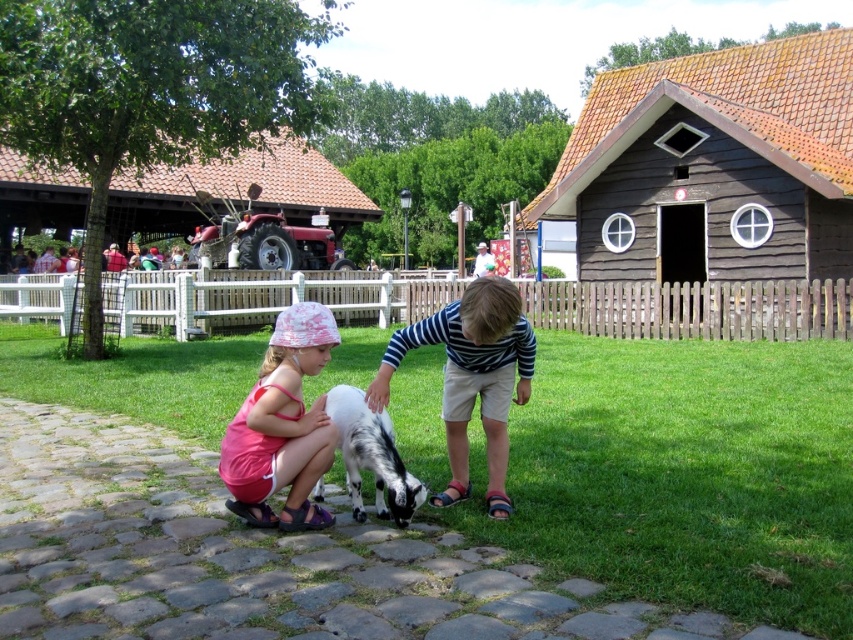
You are standing at the center of the image and want to walk towards the green grass at center. Which direction should you move to reach it?

The green grass at center is already at the center of the image, so you donot need to move in any direction to reach it.

You are a photographer standing in the scene. You want to take a photo of the striped cotton shirt at center and the green grass at center. Which object should you focus on first if you want the background to be blurred?

You should focus on the striped cotton shirt at center first because it is behind the green grass at center, so focusing on the shirt will keep it sharp while blurring the grass in the foreground. Alternatively, focusing on the green grass at center will blur the background including the shirt.

You are standing at the point marked as point (595,108) and want to reach the wooden fence in the background. The path is straight. If your maximum walking distance is 15 meters, can you reach the wooden fence without exceeding your limit?

The distance between you and the wooden fence is 17.55 meters, which exceeds your maximum walking distance of 15 meters. Therefore, you cannot reach the wooden fence without exceeding your limit.